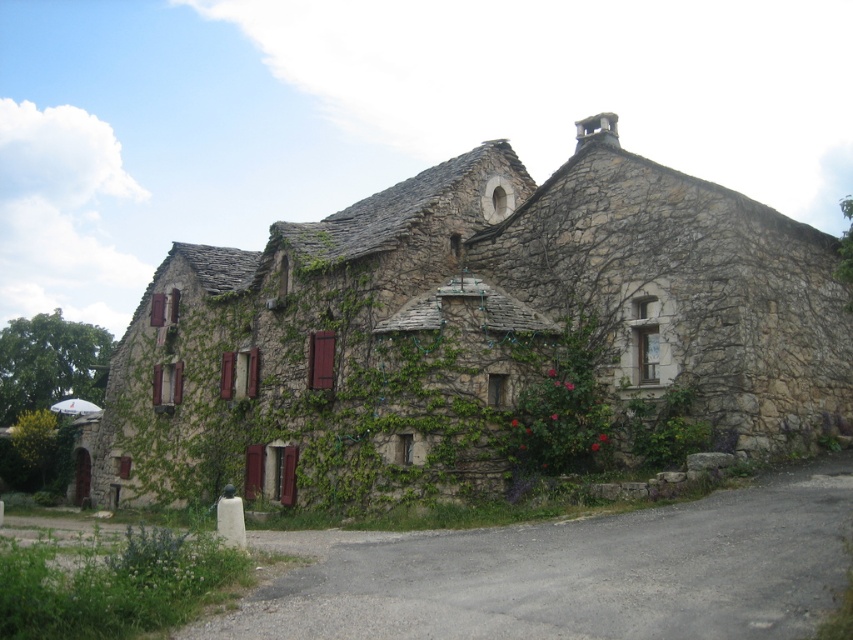
Question: Is natural stone cottage at center positioned behind gray asphalt driveway at lower center?

Choices:
 (A) yes
 (B) no

Answer: (A)

Question: Is natural stone cottage at center smaller than gray asphalt driveway at lower center?

Choices:
 (A) no
 (B) yes

Answer: (A)

Question: Can you confirm if natural stone cottage at center is positioned to the left of gray asphalt driveway at lower center?

Choices:
 (A) no
 (B) yes

Answer: (B)

Question: Which point is closer to the camera?

Choices:
 (A) natural stone cottage at center
 (B) gray asphalt driveway at lower center

Answer: (B)

Question: Which of the following is the farthest from the observer?

Choices:
 (A) (355, 563)
 (B) (670, 337)

Answer: (B)

Question: Which object appears closest to the camera in this image?

Choices:
 (A) gray asphalt driveway at lower center
 (B) natural stone cottage at center

Answer: (A)